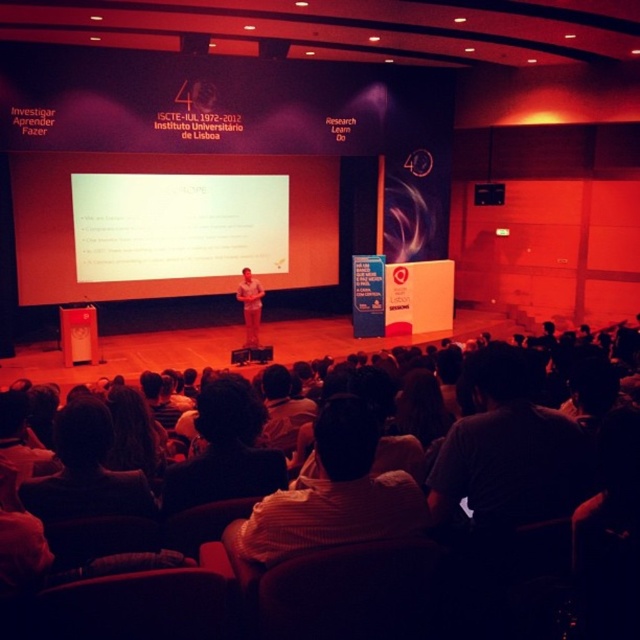
You are standing at the point marked as point [33,186] in the auditorium. The speaker is on stage, and you want to move to the front row to ask a question. Considering the distance between you and the speaker, is it possible to walk directly to the front without any obstacles?

The distance between you and the speaker is 35.85 feet. Since there are no obstacles mentioned in the scene description, you can walk directly to the front.

You are an event organizer who needs to adjust the seating arrangement. You notice the dark gray shirt at lower right and the striped shirt at center. Which attendee is sitting closer to the stage?

The dark gray shirt at lower right is positioned over striped shirt at center, meaning the dark gray shirt at lower right is closer to the stage.

You are a photographer positioned at the back of the auditorium and want to capture a clear photo of both the white matte projection screen at center and the striped shirt at center. The camera you are using has a maximum focus range of 10 meters. Will you be able to capture both subjects in focus?

The distance between the white matte projection screen at center and striped shirt at center is 10.98 meters, which exceeds the camera maximum focus range of 10 meters. Therefore, you can not capture both subjects in focus.